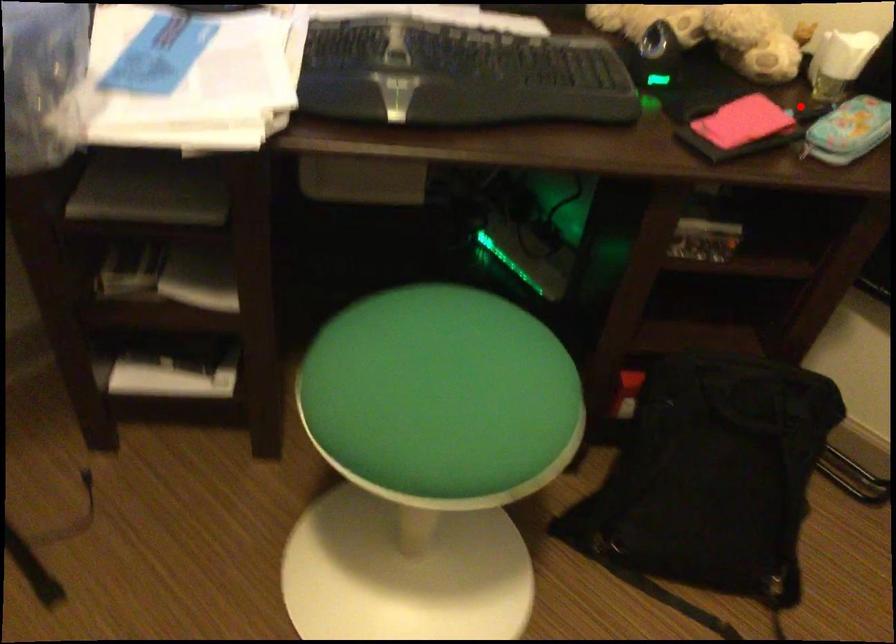
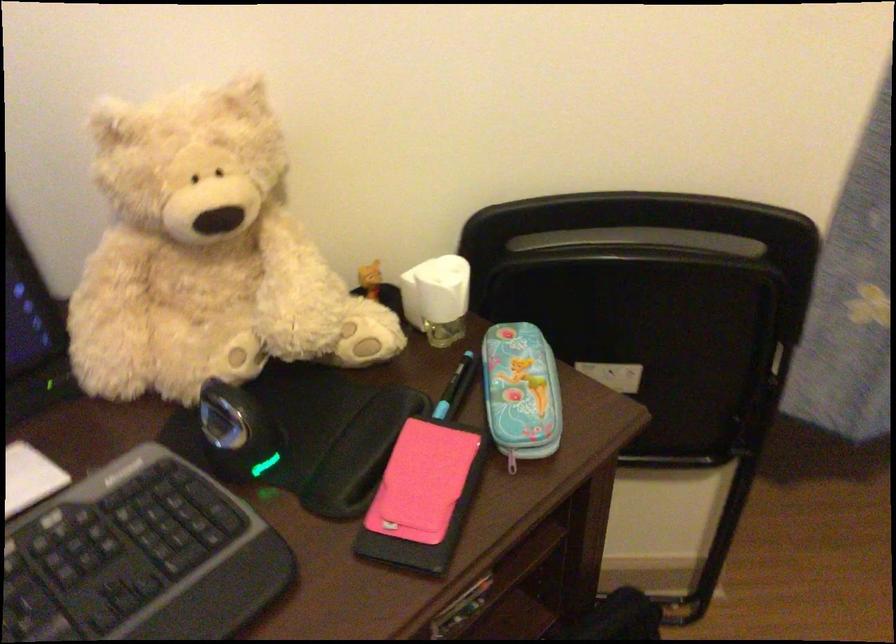
In the second image, find the point that corresponds to the highlighted location in the first image.

(455, 389)